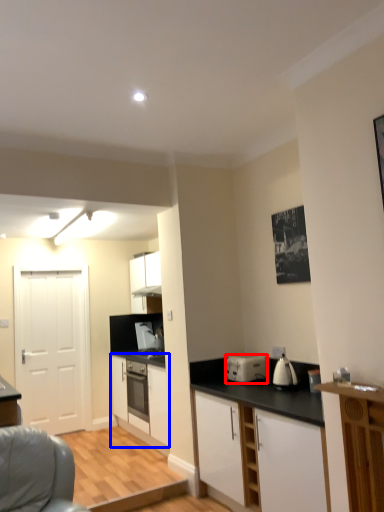
Question: Among these objects, which one is farthest to the camera, kitchen appliance (highlighted by a red box) or cabinetry (highlighted by a blue box)?

Choices:
 (A) kitchen appliance
 (B) cabinetry

Answer: (B)